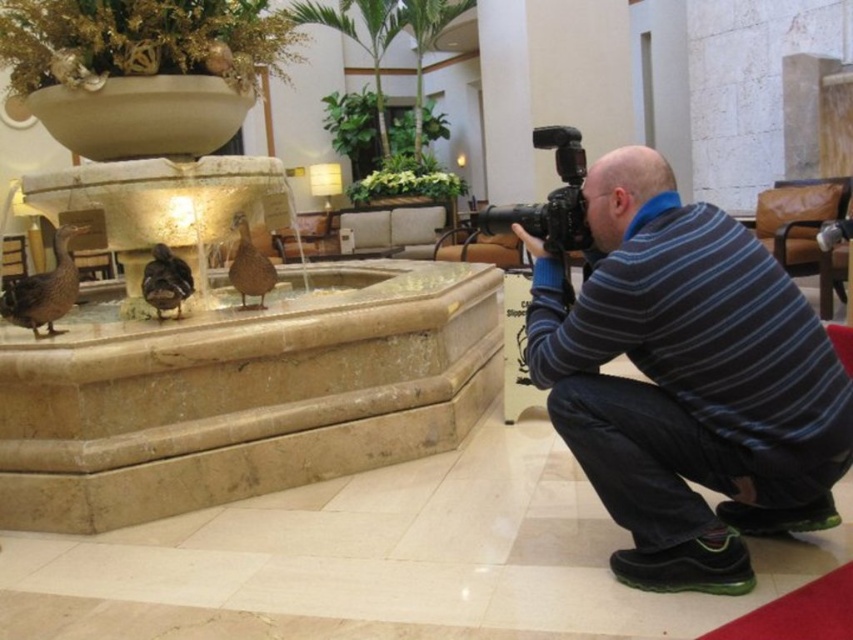
Question: Does blue striped sweater at lower right have a larger size compared to black plastic video camera at center?

Choices:
 (A) no
 (B) yes

Answer: (B)

Question: Is beige marble fountain at lower left to the right of blue striped sweater at lower right from the viewer's perspective?

Choices:
 (A) no
 (B) yes

Answer: (A)

Question: Which of these objects is positioned farthest from the beige marble fountain at lower left?

Choices:
 (A) black plastic video camera at center
 (B) blue striped sweater at lower right

Answer: (A)

Question: Which of the following is the closest to the observer?

Choices:
 (A) blue striped sweater at lower right
 (B) beige marble fountain at lower left

Answer: (A)

Question: Does blue striped sweater at lower right lie in front of black plastic video camera at center?

Choices:
 (A) no
 (B) yes

Answer: (B)

Question: Which point is closer to the camera taking this photo?

Choices:
 (A) (198, 196)
 (B) (544, 211)

Answer: (B)